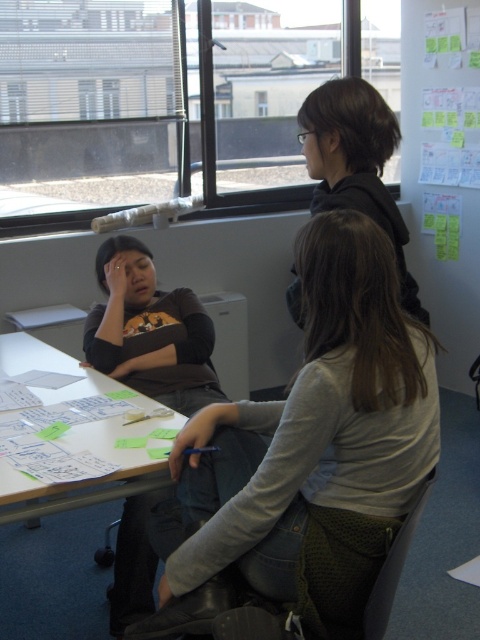
You are standing in the room and want to look outside through the transparent glass window at upper center. However, there is a person wearing the matte brown shirt at center sitting in front of the window. Can you see through the window without moving the person?

The transparent glass window at upper center is taller than the matte brown shirt at center, so yes, you can see through the window above the person wearing the matte brown shirt at center.

You are standing in the room and want to hand a document to the person wearing the gray fabric jacket at center without moving your position. The document is on the table near the transparent glass window at upper center. Can you reach it from where you are?

The gray fabric jacket at center is 8.40 feet away from the transparent glass window at upper center. Since the document is on the table near the transparent glass window at upper center, you would need to stretch or move closer to reach it, as the distance between them is quite large.